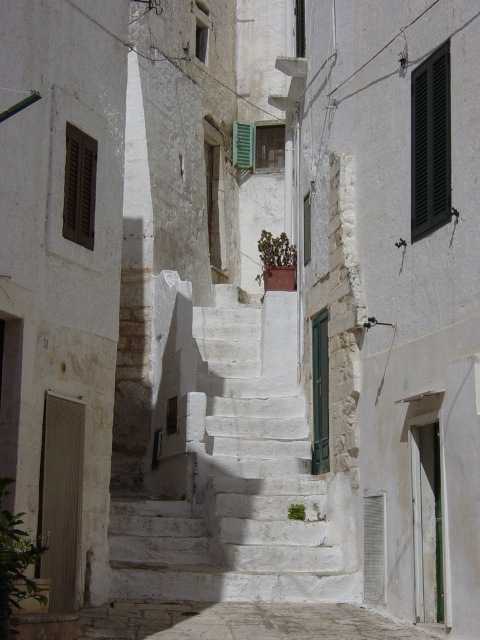
You are standing at the base of the stairs in the alleyway and see two points marked on the buildings. Which point, point [1,483] or point [265,262], is closer to you?

Point [1,483] is closer to you than point [265,262].

You are standing at the bottom of the stairs in the alleyway. You need to reach the green matte door at center. Which direction should you move to first, considering the green leafy plant at lower left is blocking your path?

The green leafy plant at lower left is located below the green matte door at center, so you should move to the right or left to go around it and reach the green matte door at center.